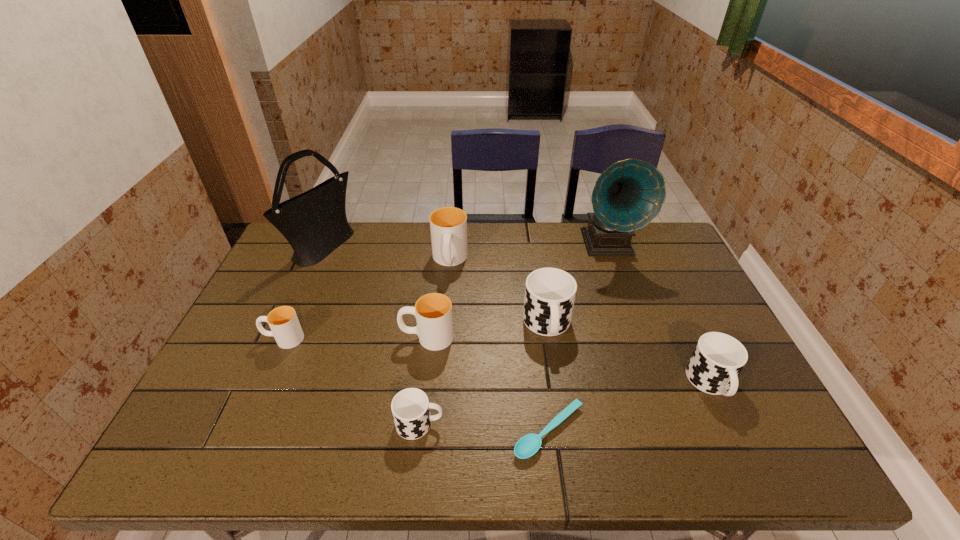
Locate an element on the screen. object that stands as the sixth closest to the phonograph_record is located at coordinates (410, 407).

Point out which object is positioned as the fourth nearest to the rightmost cup. Please provide its 2D coordinates. Your answer should be formatted as a tuple, i.e. [(x, y)], where the tuple contains the x and y coordinates of a point satisfying the conditions above.

[(433, 312)]

Identify which cup is the fifth nearest to the spoon. Please provide its 2D coordinates. Your answer should be formatted as a tuple, i.e. [(x, y)], where the tuple contains the x and y coordinates of a point satisfying the conditions above.

[(448, 225)]

The height and width of the screenshot is (540, 960). I want to click on cup that can be found as the fifth closest to the farthest black cup, so click(x=284, y=324).

You are a GUI agent. You are given a task and a screenshot of the screen. Output one action in this format:
    pyautogui.click(x=<x>, y=<y>)
    Task: Click on the yellow cup object that ranks as the second closest to the shoulder bag
    
    Given the screenshot: What is the action you would take?
    [448, 225]

Point out which yellow cup is positioned as the second nearest to the second cup from right to left. Please provide its 2D coordinates. Your answer should be formatted as a tuple, i.e. [(x, y)], where the tuple contains the x and y coordinates of a point satisfying the conditions above.

[(448, 225)]

Locate an element on the screen. black cup that is the nearest to the second smallest black cup is located at coordinates (550, 293).

Point out which black cup is positioned as the nearest to the shoulder bag. Please provide its 2D coordinates. Your answer should be formatted as a tuple, i.e. [(x, y)], where the tuple contains the x and y coordinates of a point satisfying the conditions above.

[(410, 407)]

This screenshot has height=540, width=960. Find the location of `vacant space that satisfies the following two spatial constraints: 1. with the handle on the side of the shoulder bag; 2. on the left side of the leftmost yellow cup`. vacant space that satisfies the following two spatial constraints: 1. with the handle on the side of the shoulder bag; 2. on the left side of the leftmost yellow cup is located at coordinates [x=324, y=248].

Where is `free spot that satisfies the following two spatial constraints: 1. from the horn of the phonograph_record; 2. on the side of the smallest black cup with the handle`? Image resolution: width=960 pixels, height=540 pixels. free spot that satisfies the following two spatial constraints: 1. from the horn of the phonograph_record; 2. on the side of the smallest black cup with the handle is located at coordinates (672, 424).